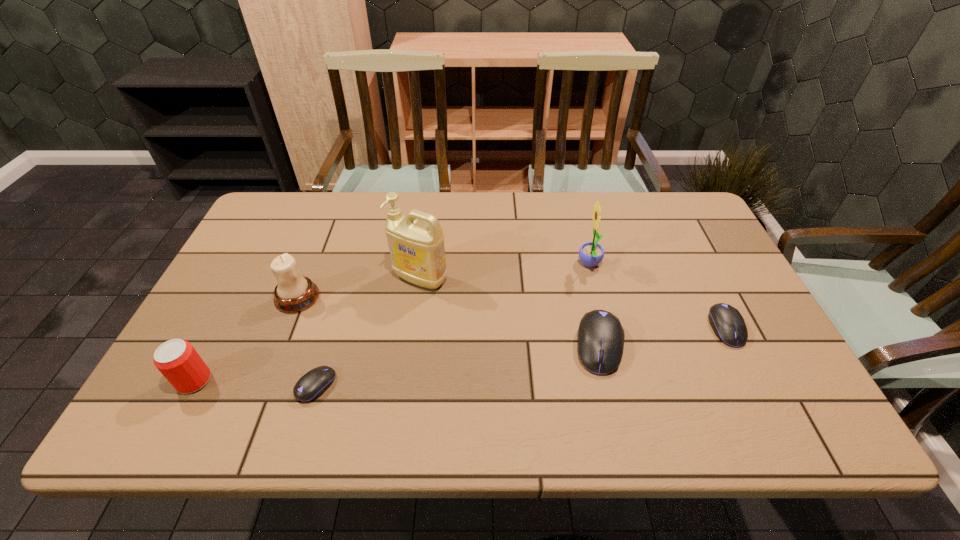
Locate an element on the screen. detergent is located at coordinates (416, 241).

Where is `the leftmost object`? This screenshot has height=540, width=960. the leftmost object is located at coordinates (177, 360).

The width and height of the screenshot is (960, 540). Identify the location of the fourth tallest object. (177, 360).

I want to click on vacant space located 0.210m on the back of the leftmost computer mouse, so [342, 300].

In order to click on free location located on the right of the third shortest object in this screenshot , I will do `click(760, 346)`.

The height and width of the screenshot is (540, 960). Identify the location of vacant space located on the back of the second tallest computer mouse. (679, 233).

In order to click on blank space located on the front-facing side of the sixth shortest object in this screenshot , I will do `click(469, 265)`.

Find the location of `free space located on the front-facing side of the sixth shortest object`. free space located on the front-facing side of the sixth shortest object is located at coordinates (493, 265).

At what (x,y) coordinates should I click in order to perform the action: click on vacant position located on the front-facing side of the sixth shortest object. Please return your answer as a coordinate pair (x, y). The height and width of the screenshot is (540, 960). Looking at the image, I should click on (491, 265).

The height and width of the screenshot is (540, 960). I want to click on free spot located 0.150m on the back of the second object from left to right, so click(318, 246).